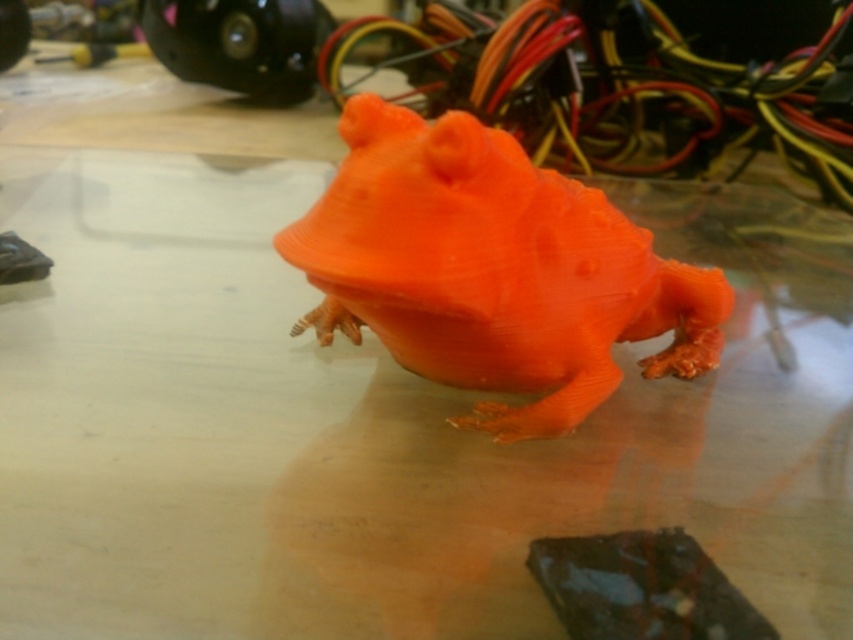
You are an engineer working in a cluttered workspace with tangled wires. You need to place a small electronic component on the orange matte plastic frog at center. What are the coordinates where you should place it?

The coordinates for the orange matte plastic frog at center are at point (492, 269). Place the component there.

You are an engineer inspecting a 3D printed frog model in a workspace. You notice the orange matte plastic frog at center and the orange matte wire at upper center. Which object is positioned higher in the image?

The orange matte wire at upper center is positioned higher than the orange matte plastic frog at center.

You are an engineer working in a cluttered workspace. You need to place both the orange matte plastic frog at center and the dark chocolate bar at lower right into a storage container. The container can only hold items that are smaller than the frog. Which item will not fit?

The dark chocolate bar at lower right will not fit because the orange matte plastic frog at center is bigger than it, and the container can only hold items smaller than the frog.